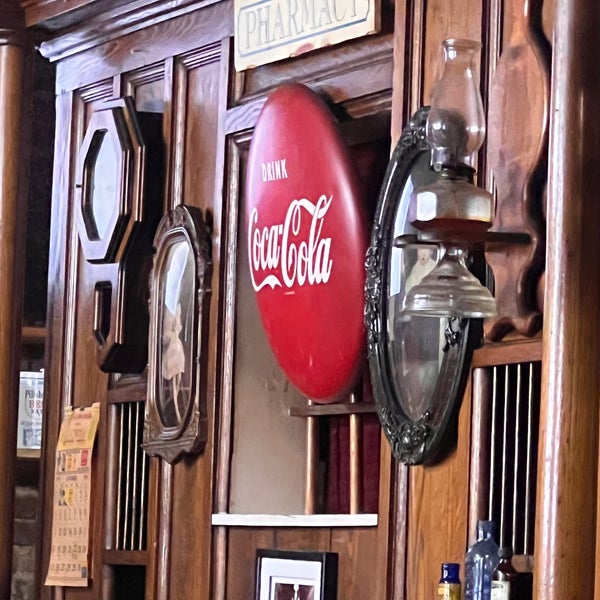
The height and width of the screenshot is (600, 600). Identify the location of calendar. (66, 503).